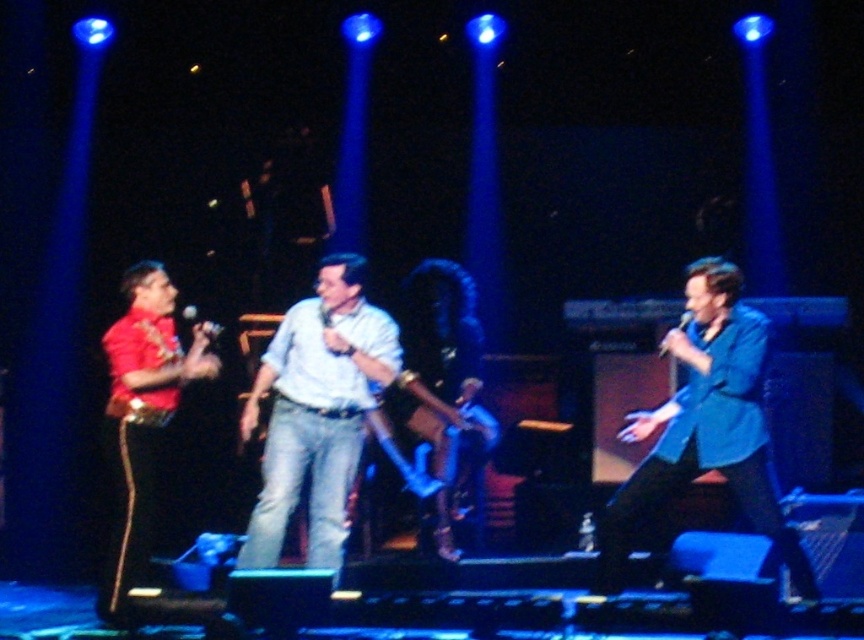
Is blue glossy suit at center to the left of black matte microphone at right from the viewer's perspective?

Indeed, blue glossy suit at center is positioned on the left side of black matte microphone at right.

Between blue glossy suit at center and black matte microphone at right, which one is positioned lower?

Positioned lower is blue glossy suit at center.

Is point (756, 365) closer to viewer compared to point (659, 348)?

Yes, point (756, 365) is in front of point (659, 348).

This screenshot has width=864, height=640. I want to click on blue glossy suit at center, so click(x=706, y=426).

Does shiny red jacket at left have a larger size compared to matte black microphone at center?

Indeed, shiny red jacket at left has a larger size compared to matte black microphone at center.

At what (x,y) coordinates should I click in order to perform the action: click on shiny red jacket at left. Please return your answer as a coordinate pair (x, y). The width and height of the screenshot is (864, 640). Looking at the image, I should click on (143, 412).

Between blue glossy suit at center and matte black microphone at center, which one appears on the right side from the viewer's perspective?

From the viewer's perspective, blue glossy suit at center appears more on the right side.

Describe the element at coordinates (706, 426) in the screenshot. I see `blue glossy suit at center` at that location.

Where is `blue glossy suit at center`? blue glossy suit at center is located at coordinates (706, 426).

This screenshot has width=864, height=640. What are the coordinates of `blue glossy suit at center` in the screenshot? It's located at (706, 426).